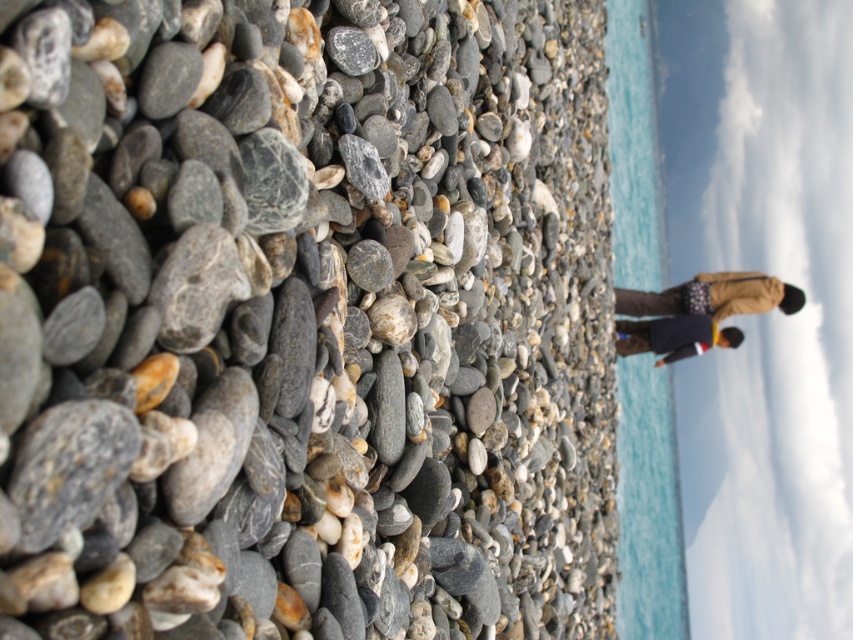
You are standing on the rocky shoreline and notice the smooth gray pebble at center and the blue water at center. Which object is positioned lower in the image?

The smooth gray pebble at center is positioned below the blue water at center, so it is lower in the image.

You are standing on the rocky shoreline and want to reach the clear blue water at right without getting your dark blue jacket at center wet. Based on the scene, which object is higher and would you need to go around it to avoid the water?

The clear blue water at right is taller than the dark blue jacket at center. To avoid getting the jacket wet, you would need to go around the clear blue water at right since it is higher and closer to your current position.